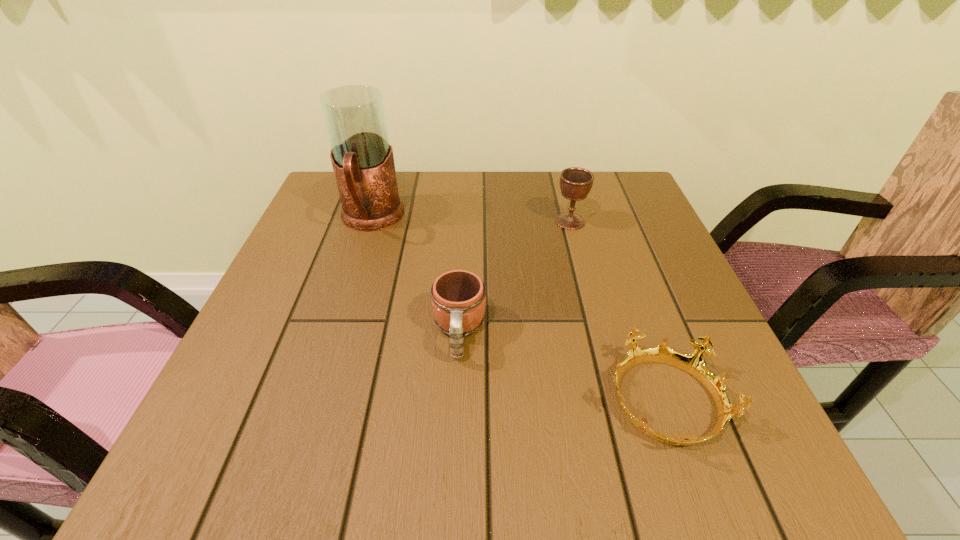
Where is `the leftmost object`? Image resolution: width=960 pixels, height=540 pixels. the leftmost object is located at coordinates (363, 163).

Where is `pitcher`? The height and width of the screenshot is (540, 960). pitcher is located at coordinates (363, 163).

Where is `chalice`? This screenshot has height=540, width=960. chalice is located at coordinates (575, 183).

You are a GUI agent. You are given a task and a screenshot of the screen. Output one action in this format:
    pyautogui.click(x=<x>, y=<y>)
    Task: Click on the third tallest object
    
    Given the screenshot: What is the action you would take?
    pyautogui.click(x=458, y=298)

Where is `mug`? This screenshot has width=960, height=540. mug is located at coordinates (458, 298).

The height and width of the screenshot is (540, 960). I want to click on the shortest object, so (692, 363).

Where is `free region located 0.300m with the handle on the side of the leftmost object`? The width and height of the screenshot is (960, 540). free region located 0.300m with the handle on the side of the leftmost object is located at coordinates (329, 351).

You are a GUI agent. You are given a task and a screenshot of the screen. Output one action in this format:
    pyautogui.click(x=<x>, y=<y>)
    Task: Click on the vacant area situated on the back of the third shortest object
    This screenshot has height=540, width=960.
    Given the screenshot: What is the action you would take?
    pyautogui.click(x=557, y=171)

Find the location of a particular element. vacant space located 0.050m on the side of the second object from left to right with the handle is located at coordinates (456, 393).

At what (x,y) coordinates should I click in order to perform the action: click on free location located 0.180m on the back of the shortest object. Please return your answer as a coordinate pair (x, y). Looking at the image, I should click on (623, 284).